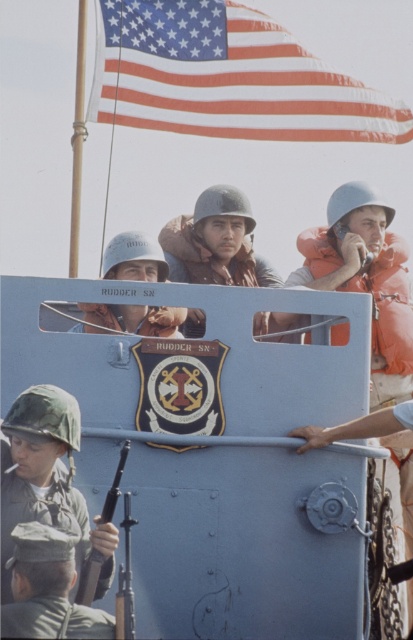
Question: Is camouflage fabric helmet at lower left above matte white helmet at center?

Choices:
 (A) yes
 (B) no

Answer: (B)

Question: Estimate the real-world distances between objects in this image. Which object is farther from the matte black rifle at lower left?

Choices:
 (A) camouflage uniform at lower left
 (B) camouflage fabric helmet at lower left
 (C) american flag at upper left
 (D) matte white helmet at center

Answer: (C)

Question: Which of the following is the farthest from the observer?

Choices:
 (A) matte black rifle at lower left
 (B) camouflage fabric helmet at lower left

Answer: (A)

Question: Is camouflage fabric helmet at lower left to the left of camouflage uniform at lower left from the viewer's perspective?

Choices:
 (A) no
 (B) yes

Answer: (B)

Question: Is american flag at upper left smaller than camouflage fabric helmet at lower left?

Choices:
 (A) yes
 (B) no

Answer: (B)

Question: Among these points, which one is nearest to the camera?

Choices:
 (A) (71, 584)
 (B) (56, 444)

Answer: (A)